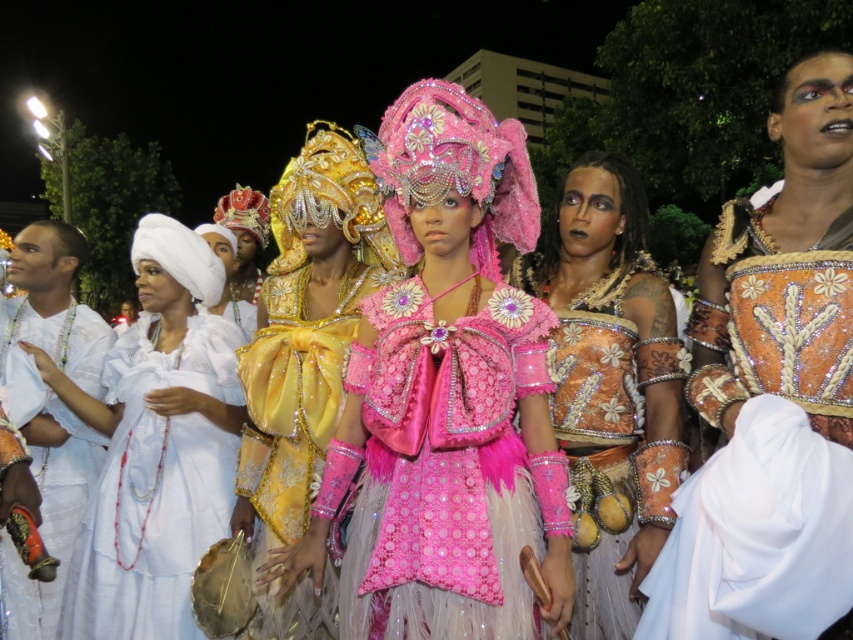
You are a photographer at the event and need to capture both the pink satin dress at center and the shiny gold dress at center in a single frame. Which dress should you adjust your camera focus on first to ensure clarity given their sizes?

The pink satin dress at center is thinner than the shiny gold dress at center, so you should focus on the shiny gold dress at center first since it is larger and might require more precise framing.

You are a photographer standing at the center of the scene. You need to capture a photo that includes both the shiny orange fabric at center and the white satin dress at left. Given the distance between them, will you be able to fit both into your camera frame without moving your position?

The distance between the shiny orange fabric at center and the white satin dress at left is 124.31 feet. Since this distance is quite large, it may be challenging to fit both into a single frame without moving your position. Consider adjusting your camera settings or using a wider lens to accommodate the space between them.

You are a photographer at the event and want to capture both the pink satin dress at center and the shiny gold dress at center in a single frame. Which dress should you position to the left side of your camera frame to ensure both are visible?

To ensure both the pink satin dress at center and the shiny gold dress at center are visible in the frame, position the shiny gold dress at center on the left side of the camera frame since the pink satin dress at center is already to the right of it.